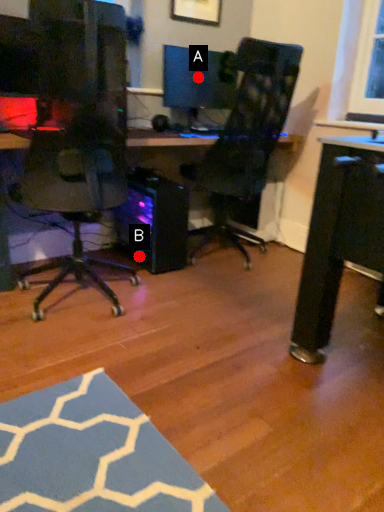
Question: Two points are circled on the image, labeled by A and B beside each circle. Among these points, which one is farthest from the camera?

Choices:
 (A) A is further
 (B) B is further

Answer: (A)